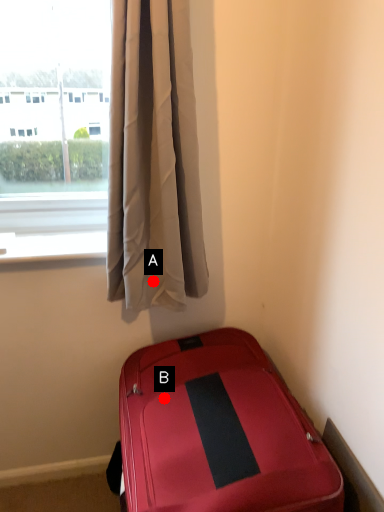
Question: Two points are circled on the image, labeled by A and B beside each circle. Which point is farther from the camera taking this photo?

Choices:
 (A) A is further
 (B) B is further

Answer: (A)